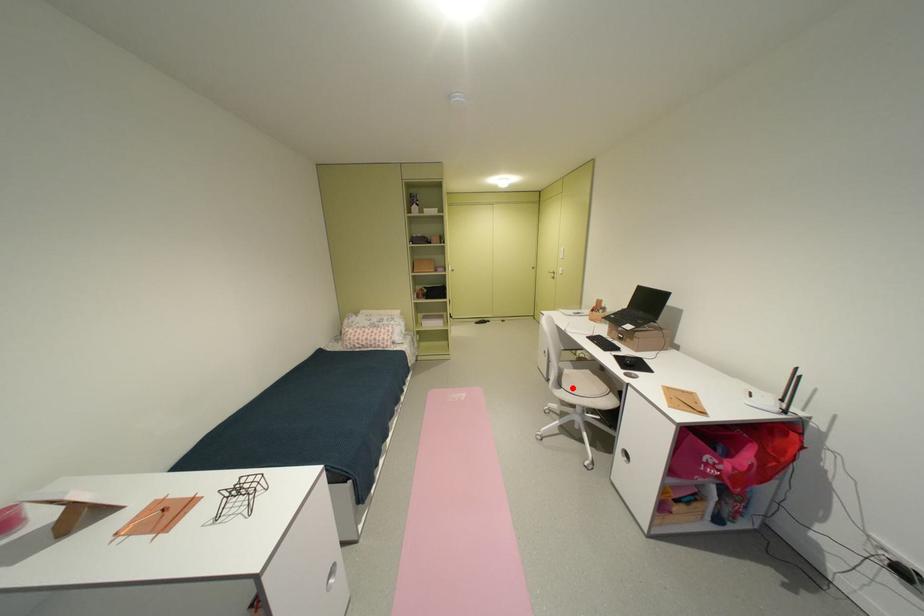
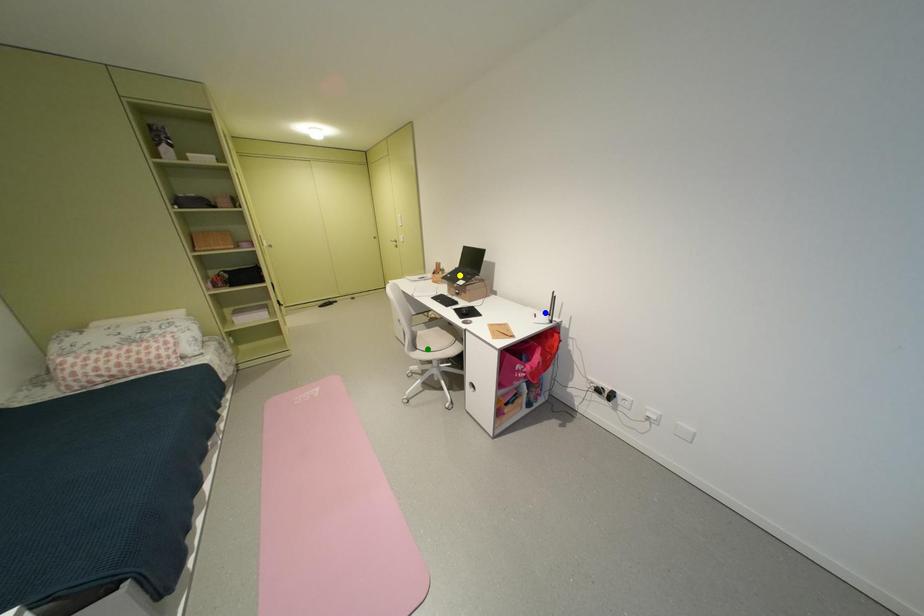
Question: I am providing you with two images of the same scene from different viewpoints. A red point is marked on the first image. You are given multiple points on the second image. Which mark in image 2 goes with the point in image 1?

Choices:
 (A) green point
 (B) yellow point
 (C) blue point

Answer: (A)